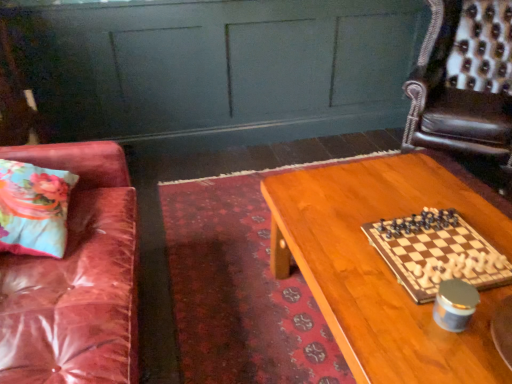
Where is `blank space to the left of wooden chessboard at center`? blank space to the left of wooden chessboard at center is located at coordinates (340, 258).